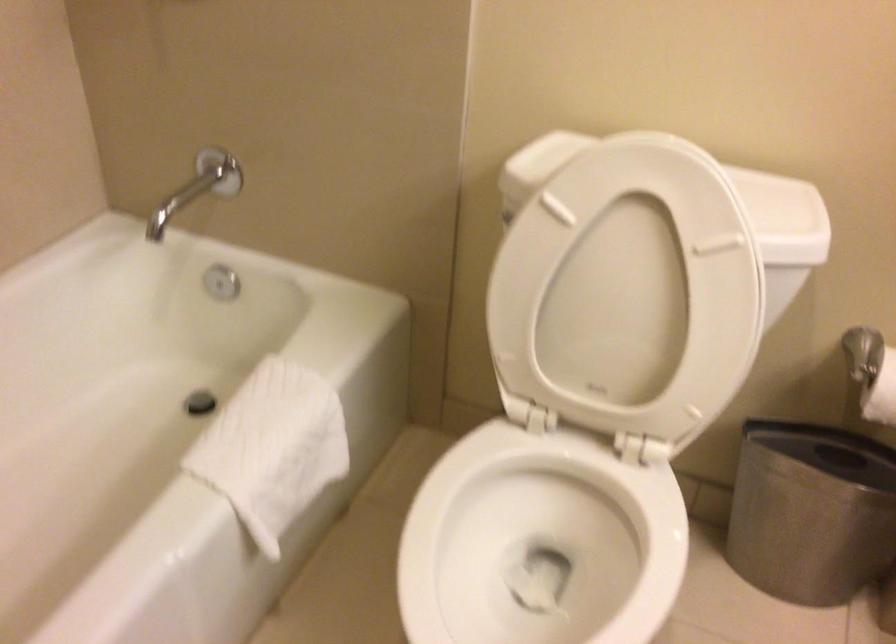
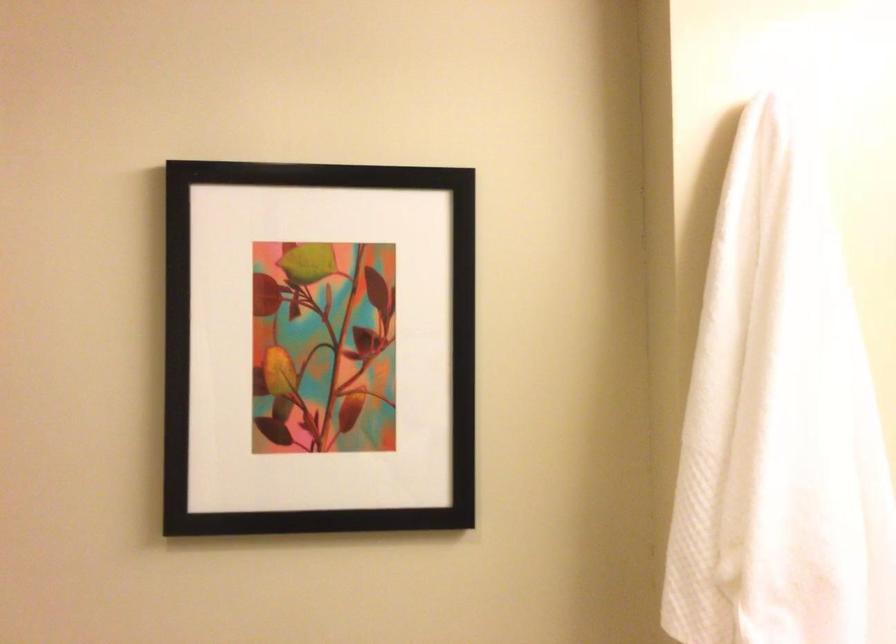
The first image is from the beginning of the video and the second image is from the end. How did the camera likely rotate when shooting the video?

The rotation direction of the camera is right-up.